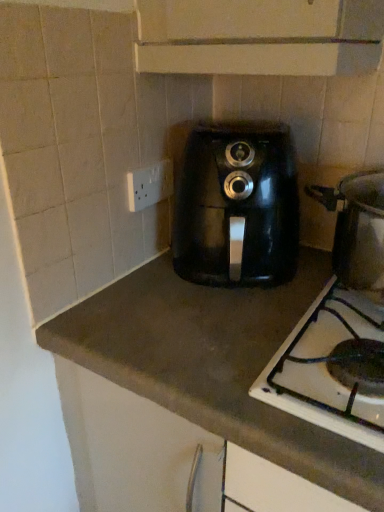
Question: Is brown matte countertop at center in front of or behind black plastic air fryer at center in the image?

Choices:
 (A) behind
 (B) front

Answer: (B)

Question: Is brown matte countertop at center spatially inside black plastic air fryer at center, or outside of it?

Choices:
 (A) inside
 (B) outside

Answer: (B)

Question: Which is nearer to the black plastic air fryer at center?

Choices:
 (A) white plastic socket at upper left
 (B) brown matte countertop at center
 (C) black matte gas stove at lower right

Answer: (B)

Question: Estimate the real-world distances between objects in this image. Which object is closer to the black matte gas stove at lower right?

Choices:
 (A) black plastic air fryer at center
 (B) white plastic socket at upper left
 (C) brown matte countertop at center

Answer: (C)